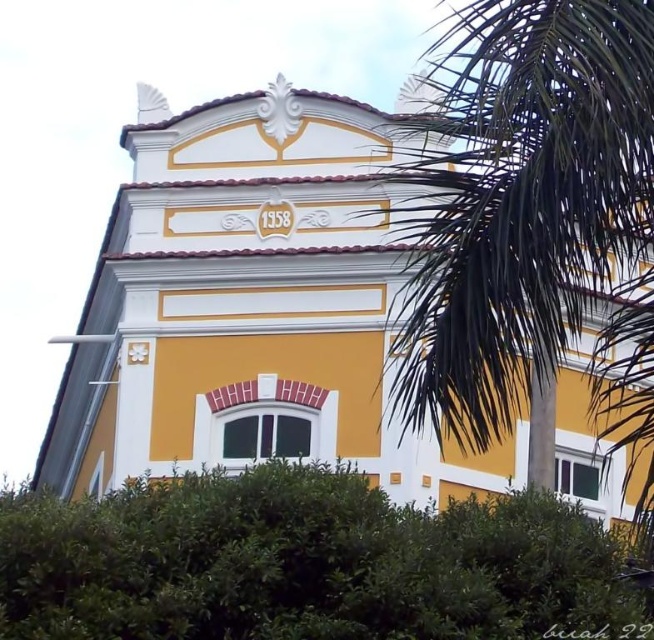
Question: Which point is farther to the camera?

Choices:
 (A) (264, 109)
 (B) (133, 561)

Answer: (A)

Question: Estimate the real-world distances between objects in this image. Which object is farther from the green leafy bush at lower center?

Choices:
 (A) green leafy palm tree at right
 (B) yellow matte building at center

Answer: (B)

Question: Does green leafy palm tree at right come in front of green leafy bush at lower center?

Choices:
 (A) no
 (B) yes

Answer: (B)

Question: Can you confirm if yellow matte building at center is positioned below green leafy bush at lower center?

Choices:
 (A) no
 (B) yes

Answer: (A)

Question: Does yellow matte building at center have a larger size compared to green leafy palm tree at right?

Choices:
 (A) no
 (B) yes

Answer: (B)

Question: Which object appears farthest from the camera in this image?

Choices:
 (A) green leafy palm tree at right
 (B) green leafy bush at lower center
 (C) yellow matte building at center

Answer: (C)